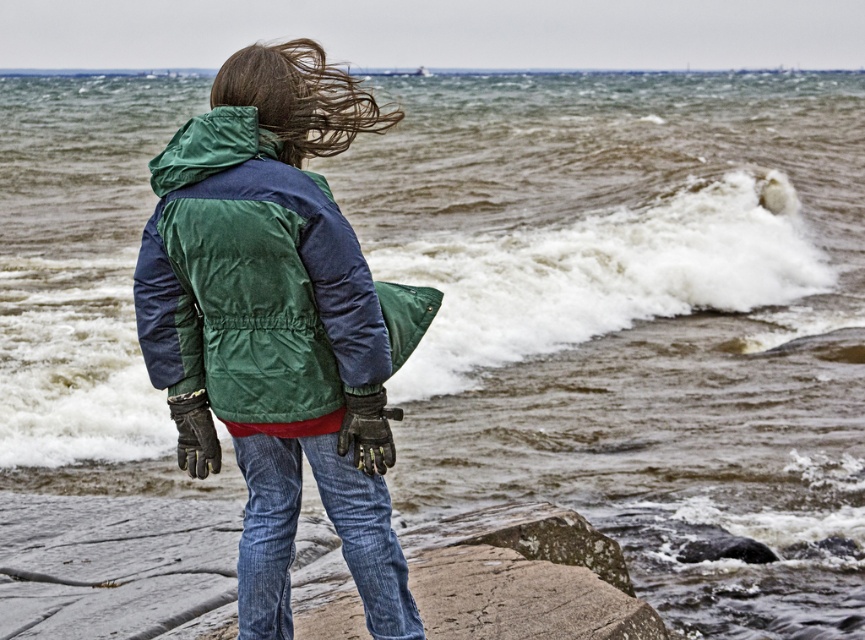
Question: Which of the following is the closest to the observer?

Choices:
 (A) (254, 436)
 (B) (396, 344)
 (C) (327, 92)

Answer: (B)

Question: Which object is positioned closest to the green quilted jacket at center?

Choices:
 (A) blonde silky hair at upper center
 (B) denim jeans at lower center

Answer: (B)

Question: Which object is positioned farthest from the green quilted jacket at center?

Choices:
 (A) denim jeans at lower center
 (B) blonde silky hair at upper center

Answer: (B)

Question: Is green quilted jacket at center thinner than denim jeans at lower center?

Choices:
 (A) no
 (B) yes

Answer: (A)

Question: Can you confirm if green quilted jacket at center is positioned to the left of denim jeans at lower center?

Choices:
 (A) yes
 (B) no

Answer: (A)

Question: Can you confirm if denim jeans at lower center is positioned above blonde silky hair at upper center?

Choices:
 (A) yes
 (B) no

Answer: (B)